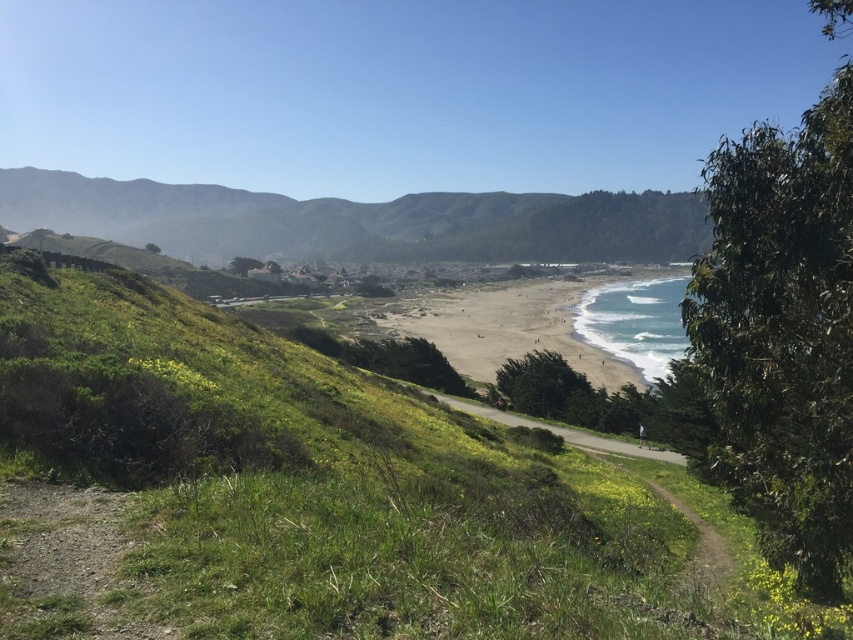
Does green grassy hillside at center have a greater height compared to sandy beach at center?

Yes, green grassy hillside at center is taller than sandy beach at center.

Does green grassy hillside at center appear over sandy beach at center?

Correct, green grassy hillside at center is located above sandy beach at center.

What are the coordinates of `green grassy hillside at center` in the screenshot? It's located at (358, 221).

Where is `green grassy hillside at center`? green grassy hillside at center is located at coordinates (358, 221).

Locate an element on the screen. This screenshot has height=640, width=853. green grassy hillside at lower left is located at coordinates (334, 484).

Consider the image. Who is more forward, (x=364, y=548) or (x=431, y=333)?

Point (x=364, y=548) is in front.

Between point (225, 358) and point (364, 320), which one is positioned behind?

The point (364, 320) is behind.

Where is `green grassy hillside at lower left`? Image resolution: width=853 pixels, height=640 pixels. green grassy hillside at lower left is located at coordinates (334, 484).

From the picture: Measure the distance between green grassy hillside at lower left and green grassy hillside at center.

A distance of 901.40 feet exists between green grassy hillside at lower left and green grassy hillside at center.

What do you see at coordinates (334, 484) in the screenshot? I see `green grassy hillside at lower left` at bounding box center [334, 484].

The image size is (853, 640). What are the coordinates of `green grassy hillside at lower left` in the screenshot? It's located at (334, 484).